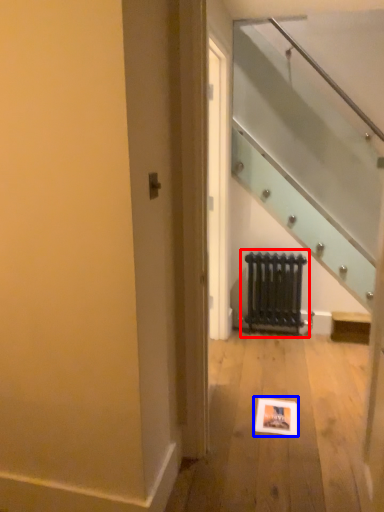
Question: Which object is further to the camera taking this photo, radiator (highlighted by a red box) or picture frame (highlighted by a blue box)?

Choices:
 (A) radiator
 (B) picture frame

Answer: (A)